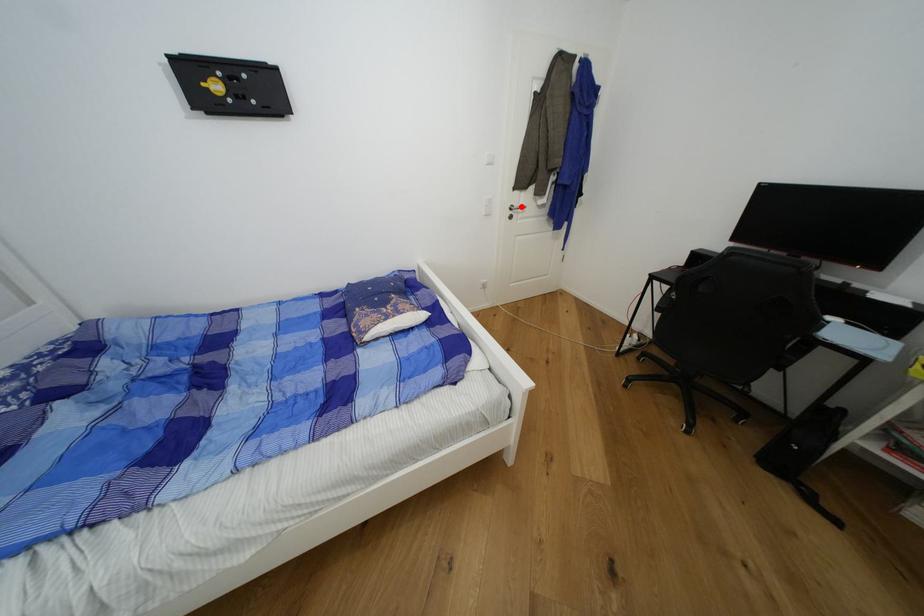
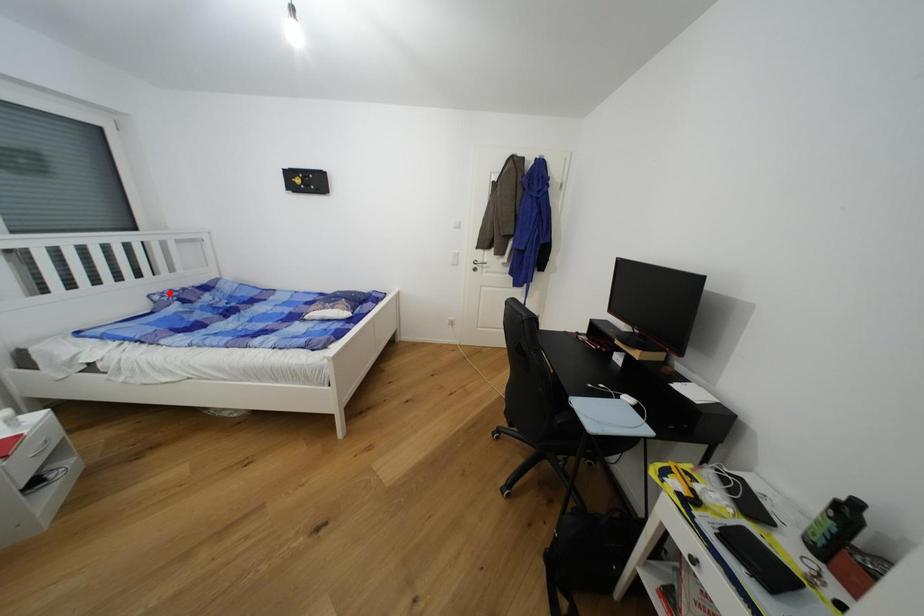
I am providing you with two images of the same scene from different viewpoints. A red point is marked on the first image and another point is marked on the second image. Do the highlighted points in image1 and image2 indicate the same real-world spot?

No